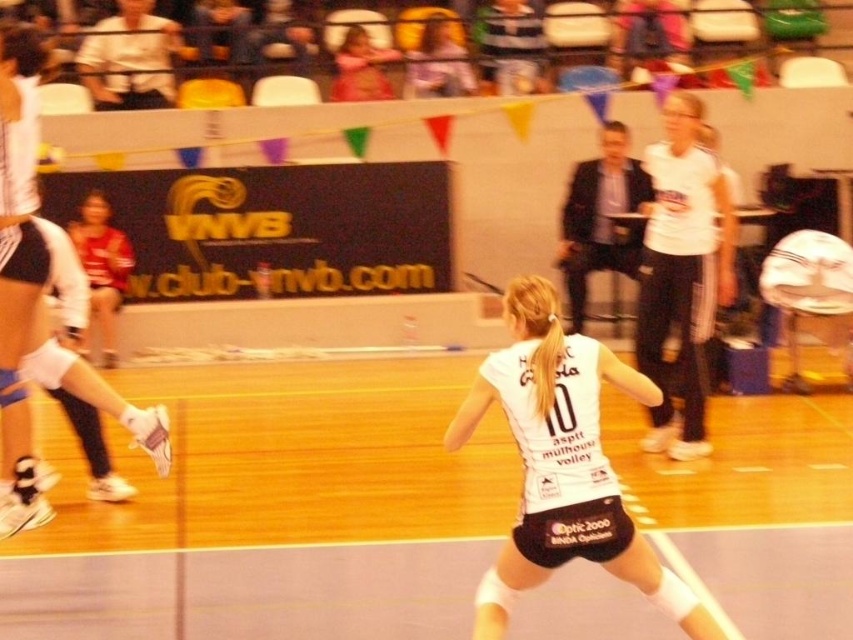
You are a photographer standing at the back of the volleyball court. You need to capture a photo of the matte white jersey at center without the pink fabric at upper center appearing in the frame. Is this possible based on their positions?

The matte white jersey at center is located below the pink fabric at upper center. Since the pink fabric is above the jersey, you can angle your camera downward to exclude the pink fabric at upper center from the frame while focusing on the matte white jersey at center.